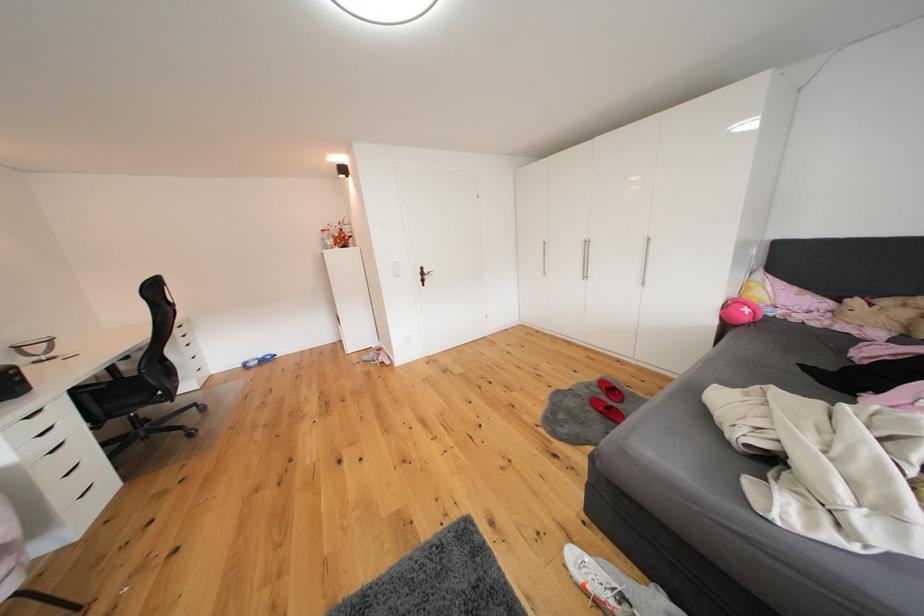
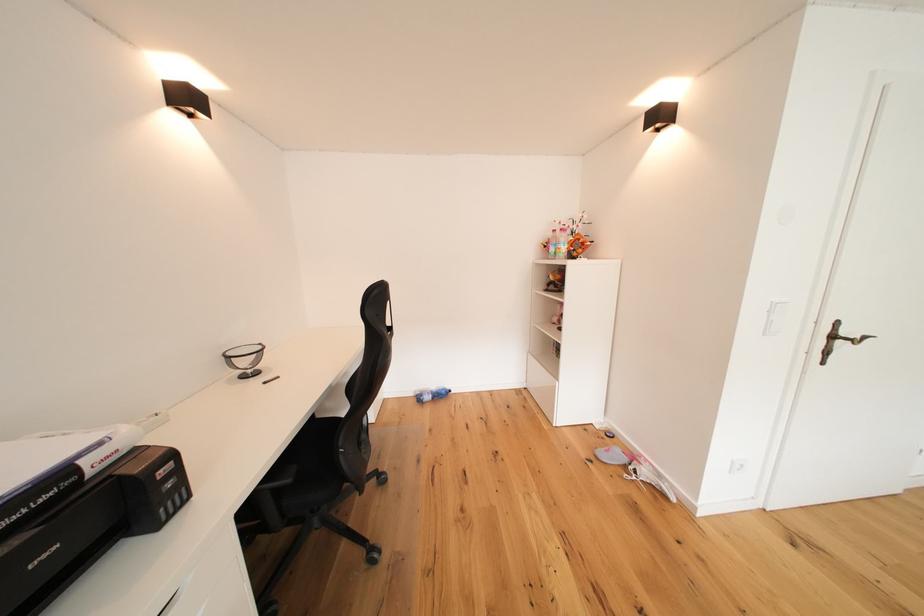
In the second image, find the point that corresponds to point 28,351 in the first image.

(237, 362)